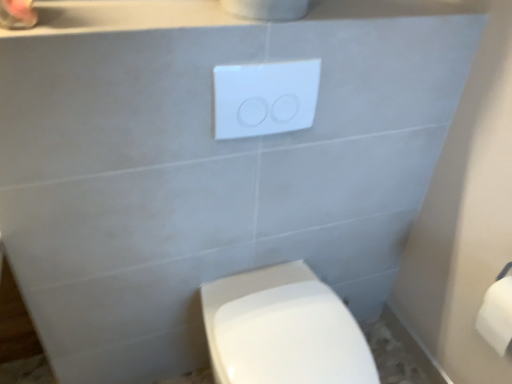
What do you see at coordinates (265, 98) in the screenshot? This screenshot has width=512, height=384. I see `white plastic/light switch at upper center` at bounding box center [265, 98].

What are the coordinates of `white glossy toilet at lower center` in the screenshot? It's located at (282, 330).

The width and height of the screenshot is (512, 384). What are the coordinates of `white matte toilet paper at right` in the screenshot? It's located at (497, 315).

Locate an element on the screen. The width and height of the screenshot is (512, 384). white plastic/light switch at upper center is located at coordinates (265, 98).

From the image's perspective, is white plastic/light switch at upper center positioned above or below white matte toilet paper at right?

white plastic/light switch at upper center is above white matte toilet paper at right.

Can you confirm if white plastic/light switch at upper center is thinner than white matte toilet paper at right?

Yes.

Is white plastic/light switch at upper center beside white matte toilet paper at right?

No, white plastic/light switch at upper center is not touching white matte toilet paper at right.

Considering the sizes of white plastic/light switch at upper center and white matte toilet paper at right in the image, is white plastic/light switch at upper center taller or shorter than white matte toilet paper at right?

white plastic/light switch at upper center is shorter than white matte toilet paper at right.

From the picture: From a real-world perspective, is white matte toilet paper at right located beneath white plastic/light switch at upper center?

Yes, from a real-world perspective, white matte toilet paper at right is below white plastic/light switch at upper center.

Considering the relative positions of white matte toilet paper at right and white plastic/light switch at upper center in the image provided, is white matte toilet paper at right to the left of white plastic/light switch at upper center from the viewer's perspective?

In fact, white matte toilet paper at right is to the right of white plastic/light switch at upper center.

Could white plastic/light switch at upper center be considered to be inside white matte toilet paper at right?

No, white plastic/light switch at upper center is not a part of white matte toilet paper at right.

From the image's perspective, is white matte toilet paper at right beneath white plastic/light switch at upper center?

Correct, white matte toilet paper at right appears lower than white plastic/light switch at upper center in the image.

Consider the image. How many degrees apart are the facing directions of white matte toilet paper at right and white glossy toilet at lower center?

There is a 89.9-degree angle between the facing directions of white matte toilet paper at right and white glossy toilet at lower center.

From a real-world perspective, between white matte toilet paper at right and white glossy toilet at lower center, who is vertically lower?

white glossy toilet at lower center is physically lower.

Considering the sizes of objects white matte toilet paper at right and white glossy toilet at lower center in the image provided, who is bigger, white matte toilet paper at right or white glossy toilet at lower center?

white glossy toilet at lower center is bigger.

Is point (498, 342) less distant than point (307, 359)?

No, it is not.

Is white glossy toilet at lower center not near white plastic/light switch at upper center?

Actually, white glossy toilet at lower center and white plastic/light switch at upper center are a little close together.

Can you tell me how much white glossy toilet at lower center and white plastic/light switch at upper center differ in facing direction?

The facing directions of white glossy toilet at lower center and white plastic/light switch at upper center are 0.609 degrees apart.

Who is taller, white glossy toilet at lower center or white plastic/light switch at upper center?

Standing taller between the two is white glossy toilet at lower center.

Is white glossy toilet at lower center turned away from white plastic/light switch at upper center?

No.

From the picture: Are white plastic/light switch at upper center and white glossy toilet at lower center far apart?

No, white plastic/light switch at upper center is in close proximity to white glossy toilet at lower center.

Is white plastic/light switch at upper center not inside white glossy toilet at lower center?

Indeed, white plastic/light switch at upper center is completely outside white glossy toilet at lower center.

Where is `light switch above the white glossy toilet at lower center (from the image's perspective)`? The height and width of the screenshot is (384, 512). light switch above the white glossy toilet at lower center (from the image's perspective) is located at coordinates coord(265,98).

From the image's perspective, who appears lower, white plastic/light switch at upper center or white glossy toilet at lower center?

white glossy toilet at lower center is shown below in the image.

From the image's perspective, which is above, white glossy toilet at lower center or white matte toilet paper at right?

From the image's view, white matte toilet paper at right is above.

Considering the sizes of objects white glossy toilet at lower center and white matte toilet paper at right in the image provided, who is shorter, white glossy toilet at lower center or white matte toilet paper at right?

With less height is white matte toilet paper at right.

Is white glossy toilet at lower center positioned behind white matte toilet paper at right?

No, it is not.

Looking at this image, is white glossy toilet at lower center positioned with its back to white matte toilet paper at right?

That's not correct — white glossy toilet at lower center is not looking away from white matte toilet paper at right.

The height and width of the screenshot is (384, 512). Identify the location of toilet paper below the white plastic/light switch at upper center (from a real-world perspective). (497, 315).

Locate an element on the screen. toilet paper behind the white plastic/light switch at upper center is located at coordinates (497, 315).

Which object lies nearer to the anchor point white glossy toilet at lower center, white plastic/light switch at upper center or white matte toilet paper at right?

Based on the image, white matte toilet paper at right appears to be nearer to white glossy toilet at lower center.

Based on their spatial positions, is white plastic/light switch at upper center or white glossy toilet at lower center further from white matte toilet paper at right?

white plastic/light switch at upper center is further to white matte toilet paper at right.

When comparing their distances from white plastic/light switch at upper center, does white glossy toilet at lower center or white matte toilet paper at right seem closer?

The object closer to white plastic/light switch at upper center is white glossy toilet at lower center.

When comparing their distances from white matte toilet paper at right, does white glossy toilet at lower center or white plastic/light switch at upper center seem further?

The object further to white matte toilet paper at right is white plastic/light switch at upper center.

Based on their spatial positions, is white matte toilet paper at right or white glossy toilet at lower center closer to white plastic/light switch at upper center?

The object closer to white plastic/light switch at upper center is white glossy toilet at lower center.

When comparing their distances from white glossy toilet at lower center, does white matte toilet paper at right or white plastic/light switch at upper center seem further?

white plastic/light switch at upper center lies further to white glossy toilet at lower center than the other object.

Find the location of `toilet paper between white plastic/light switch at upper center and white glossy toilet at lower center from top to bottom`. toilet paper between white plastic/light switch at upper center and white glossy toilet at lower center from top to bottom is located at coordinates (497, 315).